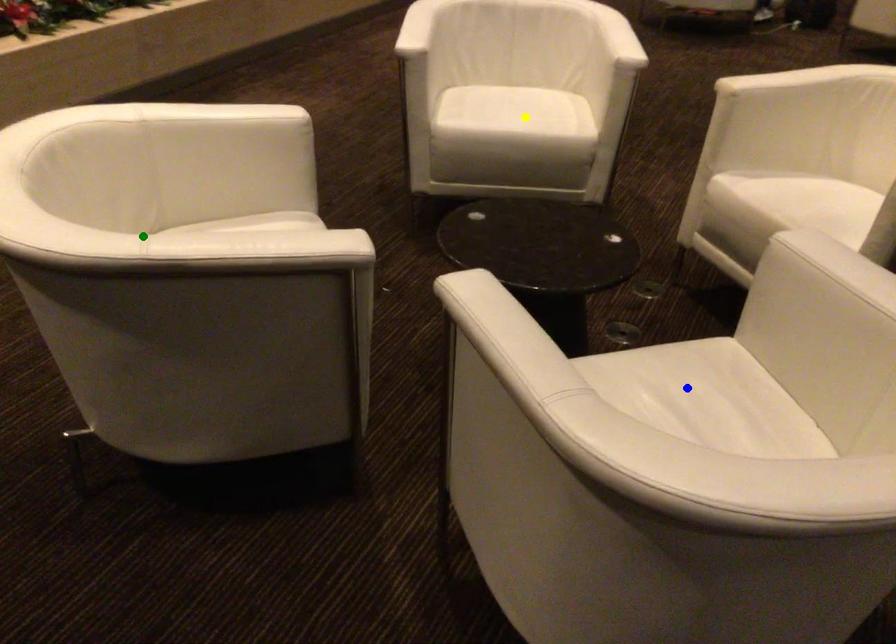
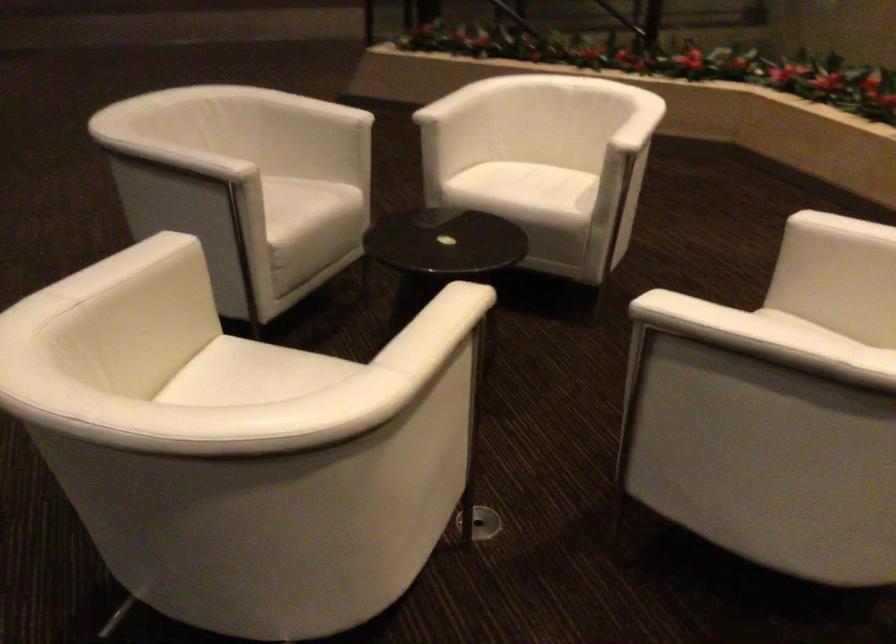
I am providing you with two images of the same scene from different viewpoints. Three points are marked in image1. Which point corresponds to a part or object that is occluded in image2?In image1, three points are marked. Which of them correspond to a part or object that is occluded in image2?Among the three points shown in image1, which one corresponds to a part or object that is no longer visible due to occlusion in image2?

Invisible in image2: yellow point, blue point.